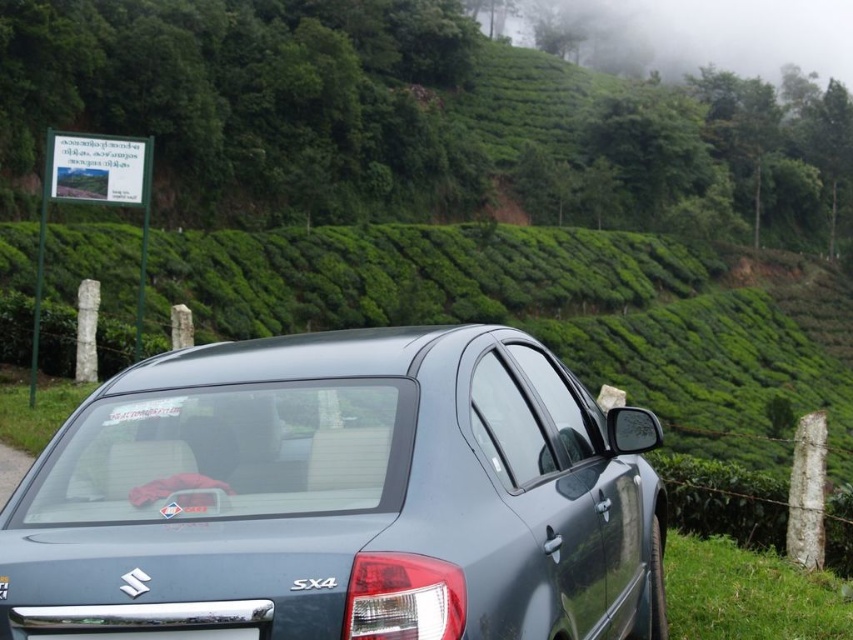
Question: Which of the following is the closest to the observer?

Choices:
 (A) black plastic license plate at lower center
 (B) foggy greenery at upper center

Answer: (A)

Question: Is satin metallic car at center positioned in front of foggy greenery at upper center?

Choices:
 (A) no
 (B) yes

Answer: (B)

Question: Is satin metallic car at center positioned at the back of black plastic license plate at lower center?

Choices:
 (A) no
 (B) yes

Answer: (A)

Question: Which point is farther to the camera?

Choices:
 (A) (660, 48)
 (B) (194, 637)
 (C) (230, 440)

Answer: (A)

Question: Among these points, which one is nearest to the camera?

Choices:
 (A) (218, 634)
 (B) (728, 8)

Answer: (A)

Question: Does foggy greenery at upper center have a larger size compared to black plastic license plate at lower center?

Choices:
 (A) yes
 (B) no

Answer: (A)